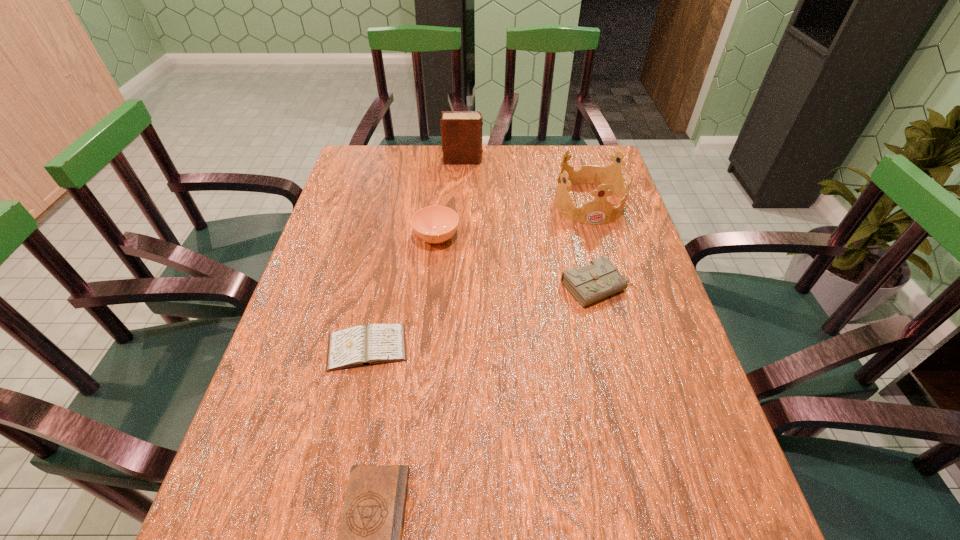
This screenshot has width=960, height=540. I want to click on the tallest diary, so click(x=461, y=131).

Image resolution: width=960 pixels, height=540 pixels. In order to click on the third diary from left to right in this screenshot , I will do `click(461, 131)`.

Where is `the fifth shortest object`? This screenshot has height=540, width=960. the fifth shortest object is located at coordinates (610, 178).

I want to click on soup bowl, so click(434, 224).

Find the location of `the fourth tallest object`. the fourth tallest object is located at coordinates coord(599,279).

You are a GUI agent. You are given a task and a screenshot of the screen. Output one action in this format:
    pyautogui.click(x=<x>, y=<y>)
    Task: Click on the third nearest diary
    
    Given the screenshot: What is the action you would take?
    pyautogui.click(x=599, y=279)

The height and width of the screenshot is (540, 960). In order to click on the third farthest diary in this screenshot , I will do `click(362, 345)`.

Identify the location of vacant space located 0.210m on the spine side of the tallest diary. This screenshot has height=540, width=960. (545, 160).

Identify the location of free region located on the front-facing side of the tiara. (610, 276).

You are a GUI agent. You are given a task and a screenshot of the screen. Output one action in this format:
    pyautogui.click(x=<x>, y=<y>)
    Task: Click on the vacant space located 0.090m on the left of the soup bowl
    This screenshot has height=540, width=960.
    Given the screenshot: What is the action you would take?
    (381, 238)